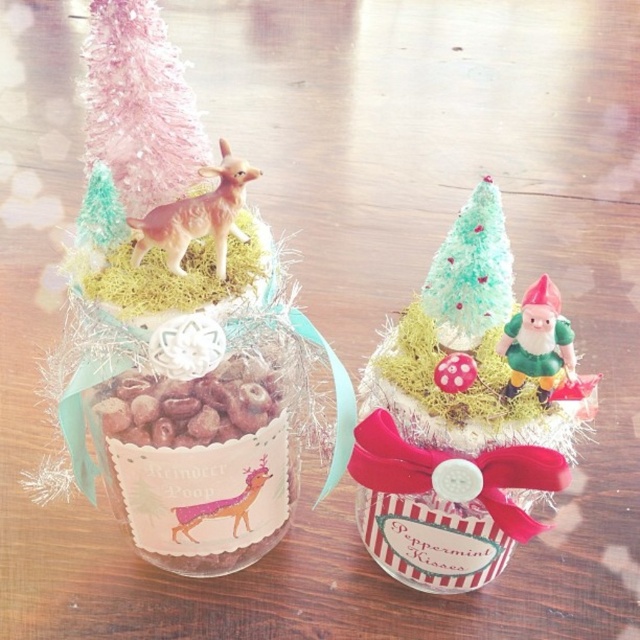
Is point (134, 125) less distant than point (497, 316)?

That is True.

Can you confirm if pink fluffy christmas tree at upper left is positioned to the left of frosted mint green christmas tree at center?

Correct, you'll find pink fluffy christmas tree at upper left to the left of frosted mint green christmas tree at center.

Find the location of a particular element. pink fluffy christmas tree at upper left is located at coordinates (140, 106).

Describe the element at coordinates (196, 216) in the screenshot. The height and width of the screenshot is (640, 640). I see `brown plastic toy deer at upper left` at that location.

Is point (150, 220) in front of point (177, 509)?

Yes, it is.

Find the location of a particular element. brown plastic toy deer at upper left is located at coordinates (196, 216).

Is frosted mint green christmas tree at center closer to camera compared to green matte/glossy gnome at upper right?

No, frosted mint green christmas tree at center is behind green matte/glossy gnome at upper right.

Is frosted mint green christmas tree at center taller than green matte/glossy gnome at upper right?

Indeed, frosted mint green christmas tree at center has a greater height compared to green matte/glossy gnome at upper right.

Is point (500, 257) positioned after point (541, 314)?

Yes, it is behind point (541, 314).

Where is `frosted mint green christmas tree at center`? The width and height of the screenshot is (640, 640). frosted mint green christmas tree at center is located at coordinates (470, 273).